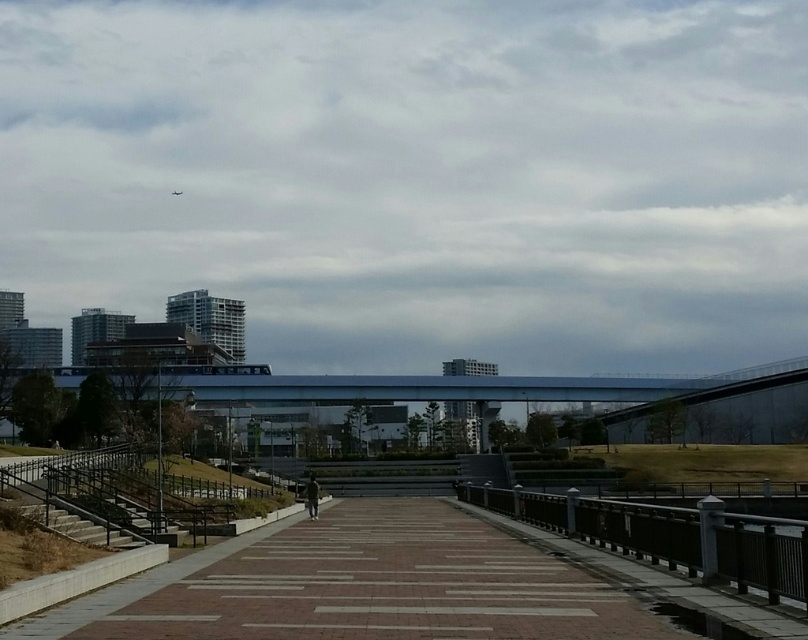
Question: Observing the image, what is the correct spatial positioning of brick paved walkway at center in reference to blue glass pedestrian bridge at center?

Choices:
 (A) below
 (B) above

Answer: (B)

Question: Which of the following is the closest to the observer?

Choices:
 (A) (529, 566)
 (B) (604, 536)
 (C) (293, 385)

Answer: (A)

Question: Observing the image, what is the correct spatial positioning of brick paved walkway at center in reference to blue glass pedestrian bridge at center?

Choices:
 (A) below
 (B) above

Answer: (B)

Question: Which point appears farthest from the camera in this image?

Choices:
 (A) (288, 611)
 (B) (554, 396)

Answer: (B)

Question: Which point appears closest to the camera in this image?

Choices:
 (A) pos(499,396)
 (B) pos(693,513)

Answer: (B)

Question: Where is brick paved walkway at center located in relation to metallic gray railing at center in the image?

Choices:
 (A) below
 (B) above

Answer: (B)